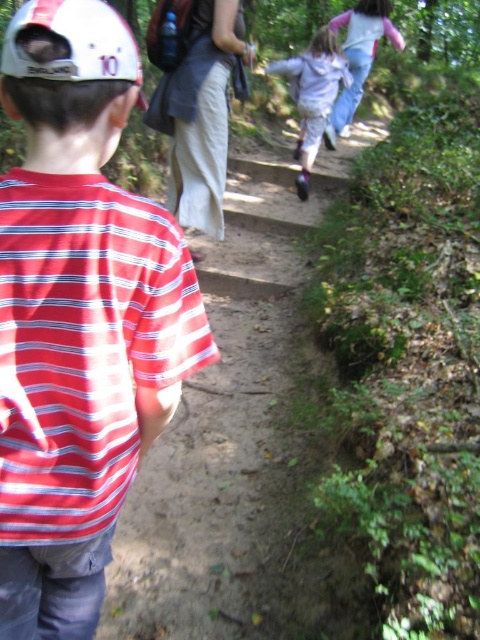
Question: Is dirt path at center above light blue jeans at upper center?

Choices:
 (A) yes
 (B) no

Answer: (B)

Question: Which object is farther from the camera taking this photo?

Choices:
 (A) light blue jeans at upper center
 (B) dirt path at center
 (C) striped cotton shirt at center

Answer: (A)

Question: Does dirt path at center have a smaller size compared to white matte baseball cap at upper left?

Choices:
 (A) yes
 (B) no

Answer: (B)

Question: Which object is farther from the camera taking this photo?

Choices:
 (A) light gray hoodie at center
 (B) striped cotton shirt at center
 (C) dirt path at center
 (D) white matte baseball cap at upper left

Answer: (A)

Question: Does dirt path at center lie behind light gray hoodie at center?

Choices:
 (A) yes
 (B) no

Answer: (B)

Question: Which point is farther to the camera?

Choices:
 (A) striped cotton shirt at center
 (B) white matte baseball cap at upper left

Answer: (B)